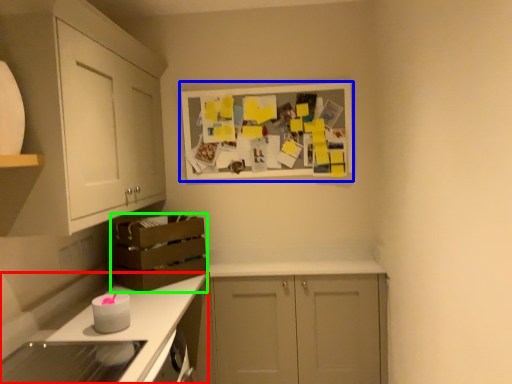
Question: Which is farther away from countertop (highlighted by a red box)? picture frame (highlighted by a blue box) or crate (highlighted by a green box)?

Choices:
 (A) picture frame
 (B) crate

Answer: (A)